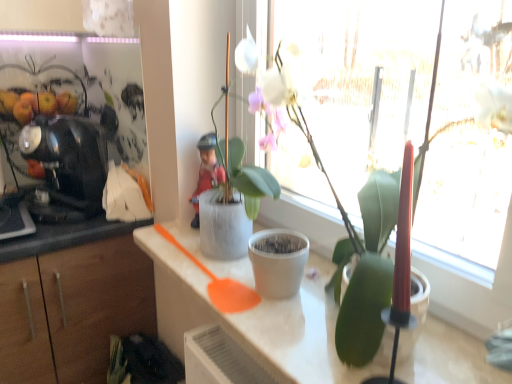
You are a GUI agent. You are given a task and a screenshot of the screen. Output one action in this format:
    pyautogui.click(x=<x>, y=<y>)
    Task: Click on the unoccupied area in front of matte red figurine at center
    This screenshot has width=512, height=384.
    Given the screenshot: What is the action you would take?
    pyautogui.click(x=190, y=250)